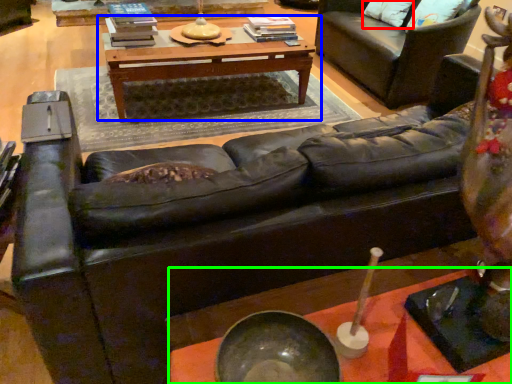
Question: Estimate the real-world distances between objects in this image. Which object is farther from pillow (highlighted by a red box), table (highlighted by a blue box) or table (highlighted by a green box)?

Choices:
 (A) table
 (B) table

Answer: (B)